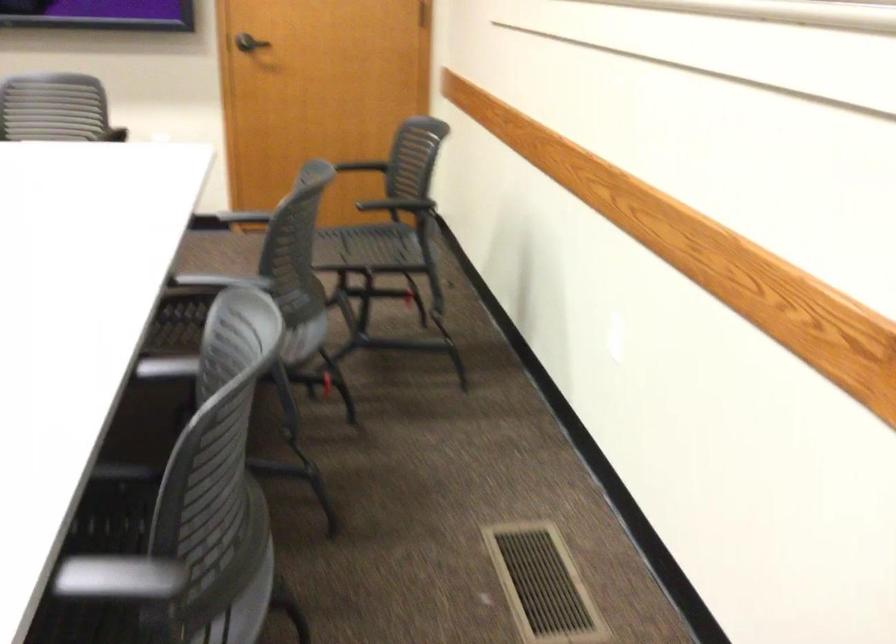
What do you see at coordinates (738, 185) in the screenshot? I see `a wooden handrail` at bounding box center [738, 185].